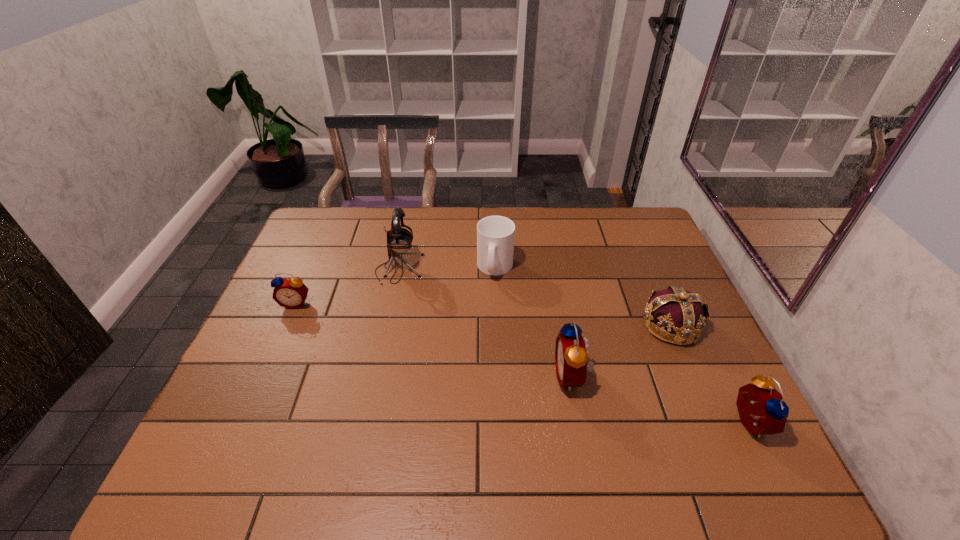
Please point a spot to place another alarm_clock for symmetrical spacing. Please provide its 2D coordinates. Your answer should be formatted as a tuple, i.e. [(x, y)], where the tuple contains the x and y coordinates of a point satisfying the conditions above.

[(422, 336)]